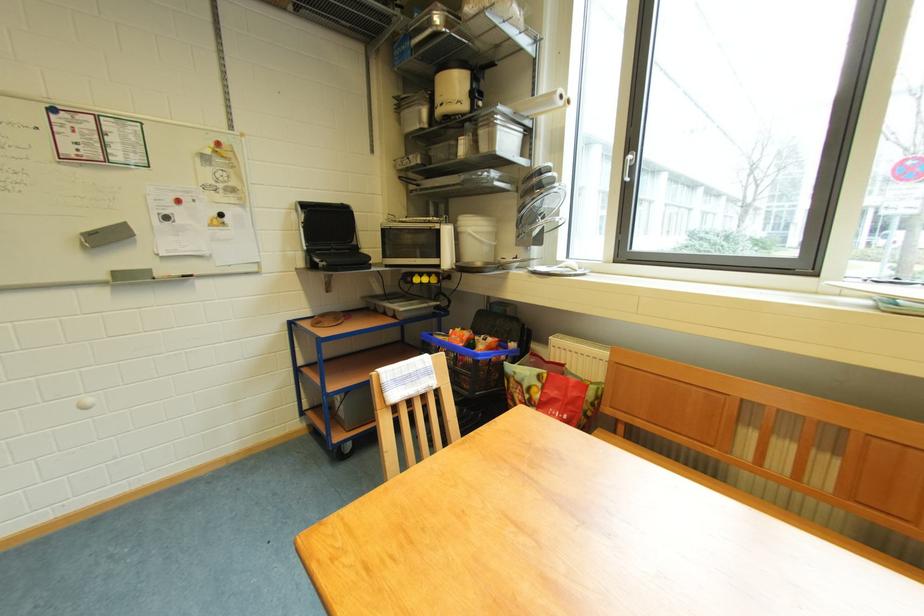
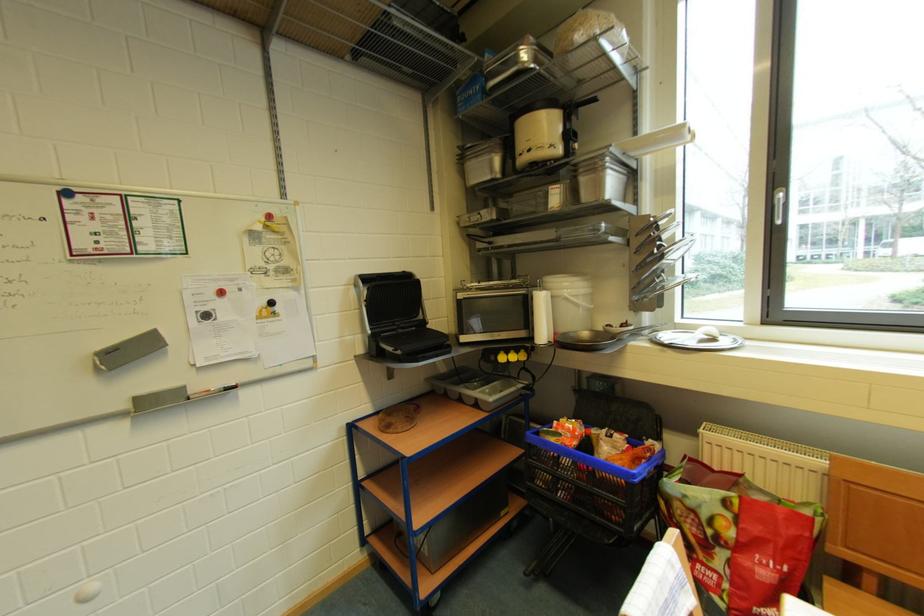
The point at (417,282) is marked in the first image. Where is the corresponding point in the second image?

(500, 361)